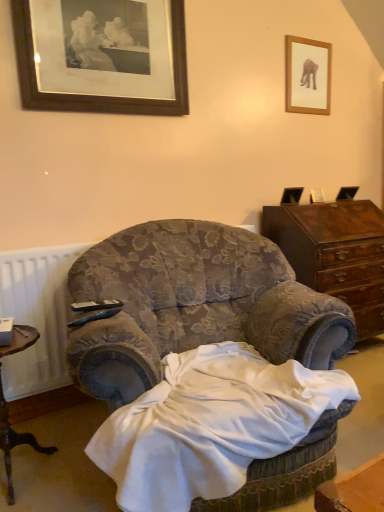
Question: Considering the relative sizes of black plastic remote control at lower left, acting as the 2th remote control starting from the back, and black plastic remote control at center, the 2th remote control positioned from the front, in the image provided, is black plastic remote control at lower left, acting as the 2th remote control starting from the back, taller than black plastic remote control at center, the 2th remote control positioned from the front,?

Choices:
 (A) yes
 (B) no

Answer: (B)

Question: Is black plastic remote control at lower left, acting as the 2th remote control starting from the back, to the left of black plastic remote control at center, the 1th remote control in the back-to-front sequence, from the viewer's perspective?

Choices:
 (A) no
 (B) yes

Answer: (A)

Question: Considering the relative sizes of black plastic remote control at lower left, the 1th remote control positioned from the front, and black plastic remote control at center, the 2th remote control positioned from the front, in the image provided, is black plastic remote control at lower left, the 1th remote control positioned from the front, thinner than black plastic remote control at center, the 2th remote control positioned from the front,?

Choices:
 (A) yes
 (B) no

Answer: (A)

Question: Does black plastic remote control at lower left, the 1th remote control positioned from the front, have a lesser height compared to black plastic remote control at center, the 2th remote control positioned from the front?

Choices:
 (A) no
 (B) yes

Answer: (B)

Question: Are black plastic remote control at lower left, the 1th remote control positioned from the front, and black plastic remote control at center, the 1th remote control in the back-to-front sequence, far apart?

Choices:
 (A) no
 (B) yes

Answer: (A)

Question: From their relative heights in the image, would you say brown wooden desk at lower left is taller or shorter than wooden picture frame at upper right, the second picture frame from the left?

Choices:
 (A) tall
 (B) short

Answer: (A)

Question: From a real-world perspective, is brown wooden desk at lower left positioned above or below wooden picture frame at upper right, the second picture frame from the left?

Choices:
 (A) above
 (B) below

Answer: (B)

Question: Is brown wooden desk at lower left bigger or smaller than wooden picture frame at upper right, placed as the 1th picture frame when sorted from back to front?

Choices:
 (A) big
 (B) small

Answer: (A)

Question: Is brown wooden desk at lower left wider or thinner than wooden picture frame at upper right, which is counted as the 1th picture frame, starting from the right?

Choices:
 (A) thin
 (B) wide

Answer: (B)

Question: From the image's perspective, is velvet floral armchair at center positioned above or below dark brown wood cabinet at right?

Choices:
 (A) above
 (B) below

Answer: (B)

Question: Is velvet floral armchair at center wider or thinner than dark brown wood cabinet at right?

Choices:
 (A) thin
 (B) wide

Answer: (B)

Question: From their relative heights in the image, would you say velvet floral armchair at center is taller or shorter than dark brown wood cabinet at right?

Choices:
 (A) short
 (B) tall

Answer: (A)

Question: Is velvet floral armchair at center situated inside dark brown wood cabinet at right or outside?

Choices:
 (A) inside
 (B) outside

Answer: (B)

Question: From the image's perspective, is dark brown wood cabinet at right above or below velvet floral armchair at center?

Choices:
 (A) above
 (B) below

Answer: (A)

Question: From a real-world perspective, is dark brown wood cabinet at right above or below velvet floral armchair at center?

Choices:
 (A) below
 (B) above

Answer: (A)